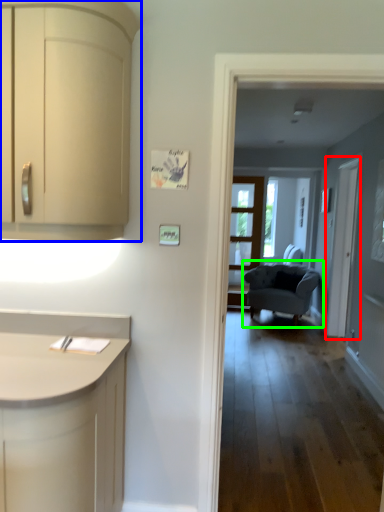
Question: Which object is the closest to the screen door (highlighted by a red box)? Choose among these: cabinetry (highlighted by a blue box) or chair (highlighted by a green box).

Choices:
 (A) cabinetry
 (B) chair

Answer: (B)